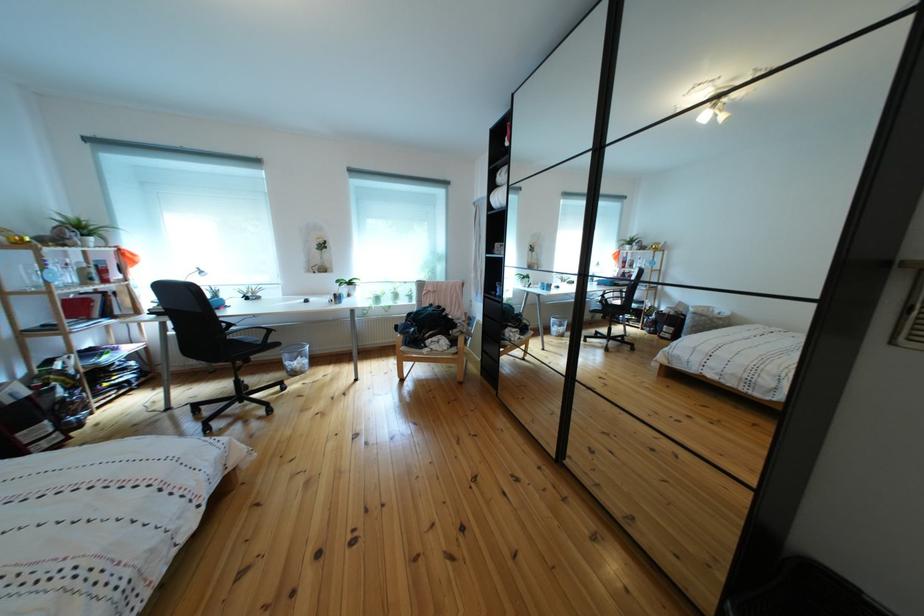
The height and width of the screenshot is (616, 924). Describe the element at coordinates (242, 342) in the screenshot. I see `the chair sitting surface` at that location.